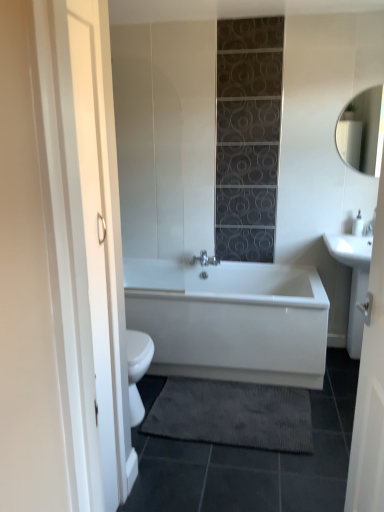
Question: Is white glossy sink at right wider or thinner than silver metallic faucet at right?

Choices:
 (A) wide
 (B) thin

Answer: (A)

Question: Considering the positions of white glossy sink at right and silver metallic faucet at right in the image, is white glossy sink at right taller or shorter than silver metallic faucet at right?

Choices:
 (A) short
 (B) tall

Answer: (B)

Question: Considering the real-world distances, which object is farthest from the white glossy sink at right?

Choices:
 (A) white glossy bathtub at center
 (B) silver metallic faucet at right
 (C) matte white mirror at upper right
 (D) dark gray textured bath mat at lower center

Answer: (D)

Question: Which object is positioned farthest from the silver metallic faucet at right?

Choices:
 (A) matte white mirror at upper right
 (B) white glossy sink at right
 (C) dark gray textured bath mat at lower center
 (D) white glossy bathtub at center

Answer: (C)